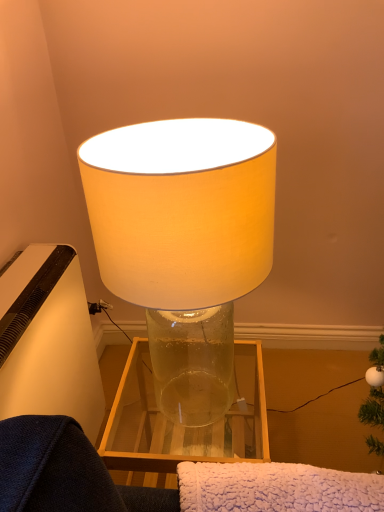
This screenshot has width=384, height=512. In order to click on matte white lampshade at center in this screenshot , I will do `click(184, 243)`.

The height and width of the screenshot is (512, 384). What do you see at coordinates (184, 243) in the screenshot?
I see `matte white lampshade at center` at bounding box center [184, 243].

What is the approximate height of matte white lampshade at center?

matte white lampshade at center is 23.69 inches tall.

Locate an element on the screen. Image resolution: width=384 pixels, height=512 pixels. matte white lampshade at center is located at coordinates (184, 243).